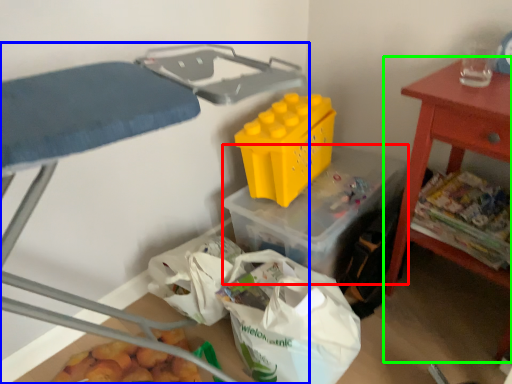
Question: Considering the real-world distances, which object is farthest from storage box (highlighted by a red box)? furniture (highlighted by a blue box) or table (highlighted by a green box)?

Choices:
 (A) furniture
 (B) table

Answer: (A)